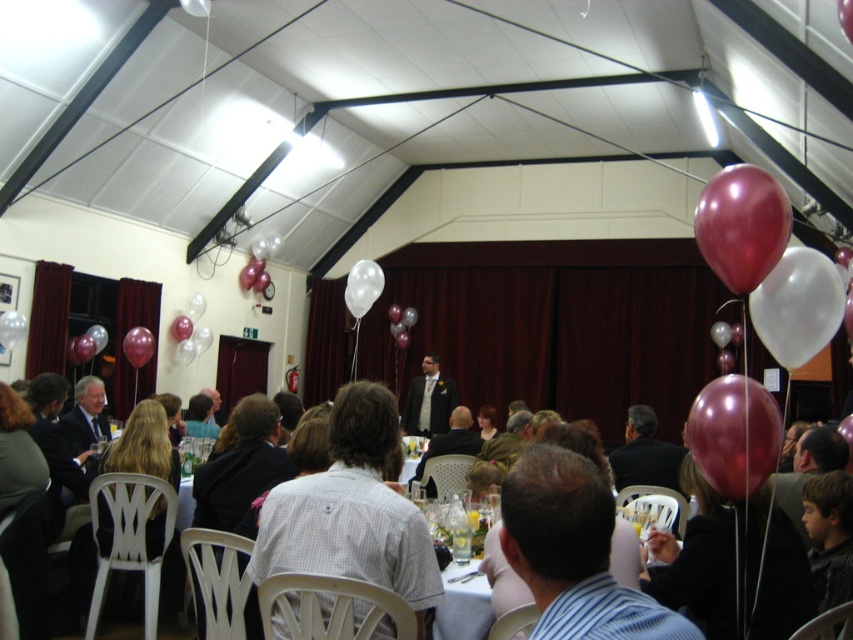
You are a guest at the event and want to pop the metallic red balloon at right. To do so, you need to move closer to it. Which direction should you move relative to the transparent white balloon at center?

You should move towards the metallic red balloon at right because it is closer to you than the transparent white balloon at center.

You are planning to hang a banner between the metallic red balloon at right and the transparent white balloon at center. Which balloon should the banner be attached to if you want the banner to hang lower?

The metallic red balloon at right is smaller than the transparent white balloon at center, so the banner should be attached to the metallic red balloon at right to hang lower.

You are standing in the room and want to reach the metallic red balloon at right. The ceiling height is 3.5 meters. Can you safely reach it without any tools?

The metallic red balloon at right is 2.15 meters from the camera. Since the ceiling is 3.5 meters high, the balloon is within reachable distance if you can jump or stand on a chair. However, without any tools, it might be challenging to reach 2.15 meters. Consider using a step stool or ask for assistance.